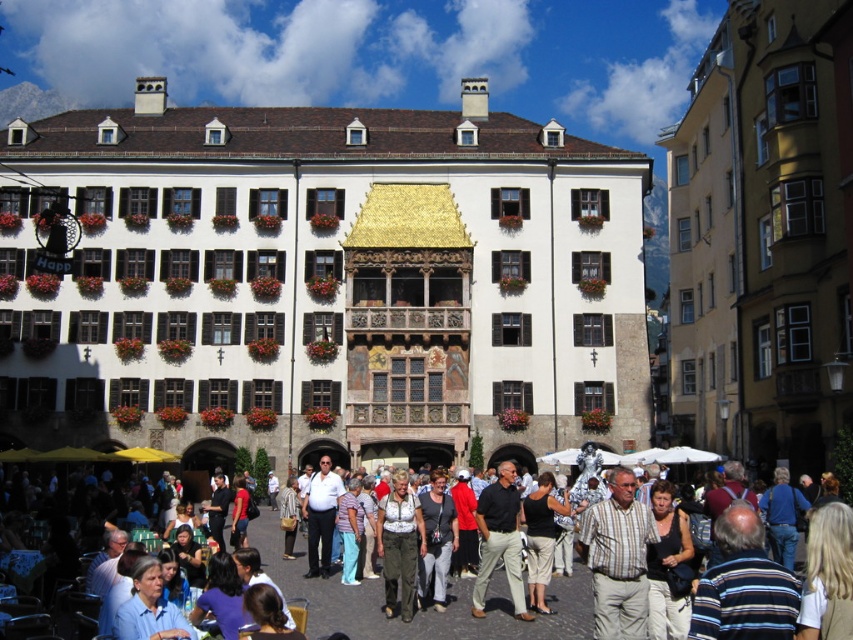
Question: Which point is closer to the camera?

Choices:
 (A) (447, 611)
 (B) (503, 477)

Answer: (A)

Question: Which point is closer to the camera?

Choices:
 (A) matte black shirt at center
 (B) black cotton shirt at center

Answer: (A)

Question: From the image, what is the correct spatial relationship of matte black shirt at center in relation to black cotton shirt at center?

Choices:
 (A) right
 (B) left

Answer: (B)

Question: In this image, where is matte black shirt at center located relative to black cotton shirt at center?

Choices:
 (A) below
 (B) above

Answer: (A)

Question: From the image, what is the correct spatial relationship of matte black shirt at center in relation to black cotton shirt at center?

Choices:
 (A) left
 (B) right

Answer: (A)